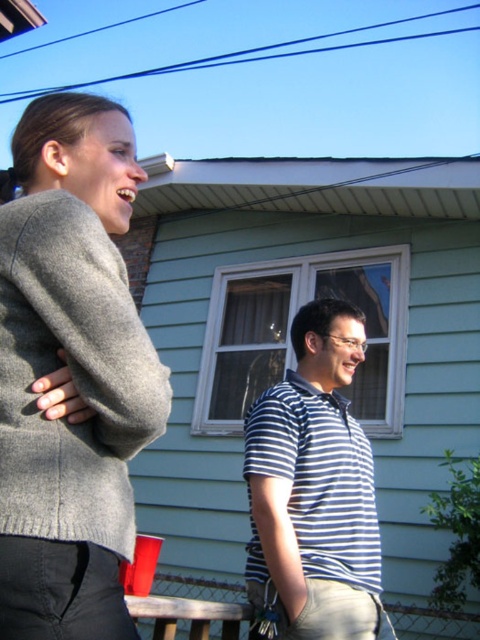
You are organizing a charity event and need to determine which of the two garments, the gray wool sweater at upper left or the blue striped shirt at center, requires more fabric to make. Based on the image, which one would you choose?

The blue striped shirt at center requires more fabric because it is larger than the gray wool sweater at upper left.

You are a fashion designer observing two people in the image. You notice the gray wool sweater at upper left and the gray wool sweater at left. Which one appears larger in size?

The gray wool sweater at left appears larger in size because it occupies more space than the gray wool sweater at upper left.